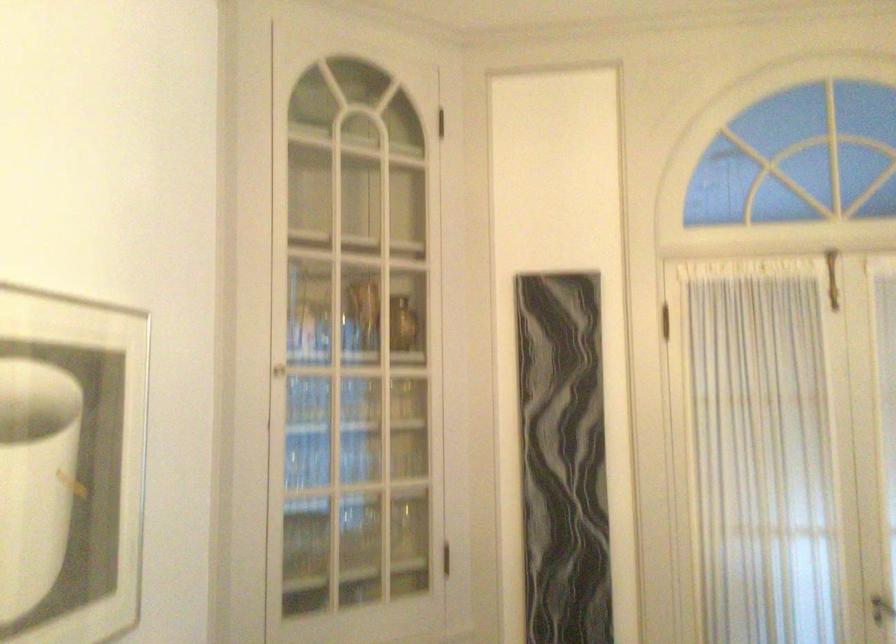
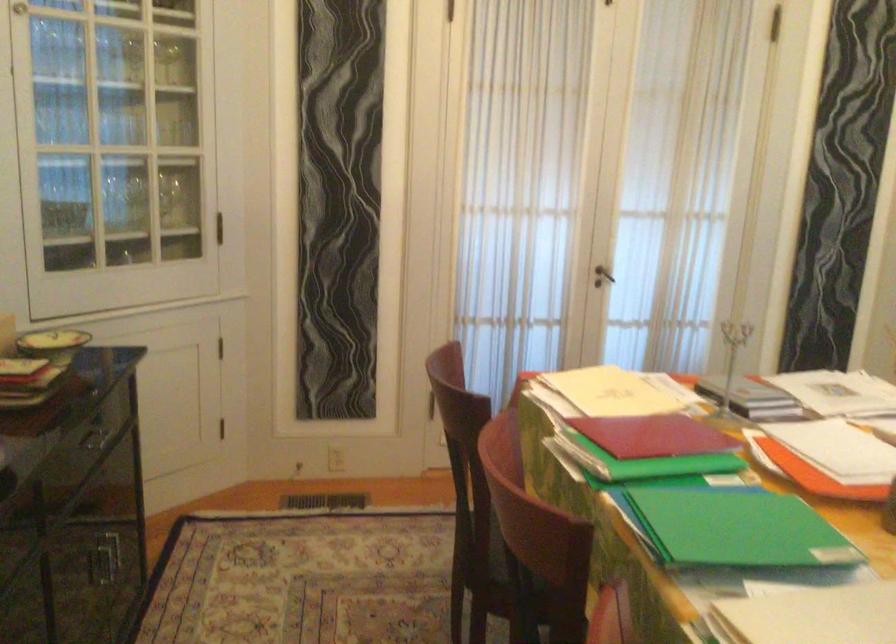
The images are taken continuously from a first-person perspective. In which direction is your viewpoint rotating?

The rotation direction of the camera is right-down.